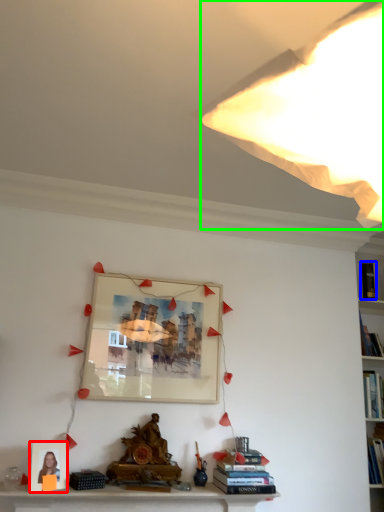
Question: Estimate the real-world distances between objects in this image. Which object is closer to picture frame (highlighted by a red box), book (highlighted by a blue box) or light (highlighted by a green box)?

Choices:
 (A) book
 (B) light

Answer: (B)